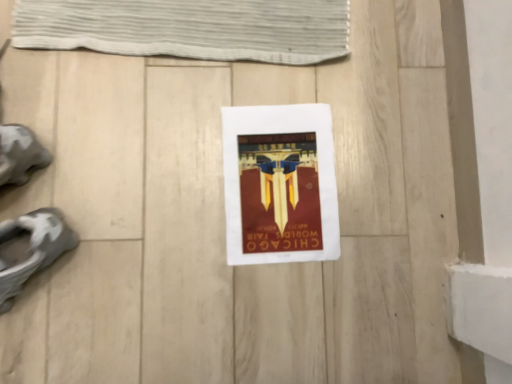
What do you see at coordinates (280, 184) in the screenshot?
I see `matte paper poster at center` at bounding box center [280, 184].

Locate an element on the screen. This screenshot has width=512, height=384. matte paper poster at center is located at coordinates (280, 184).

The image size is (512, 384). I want to click on matte paper poster at center, so click(280, 184).